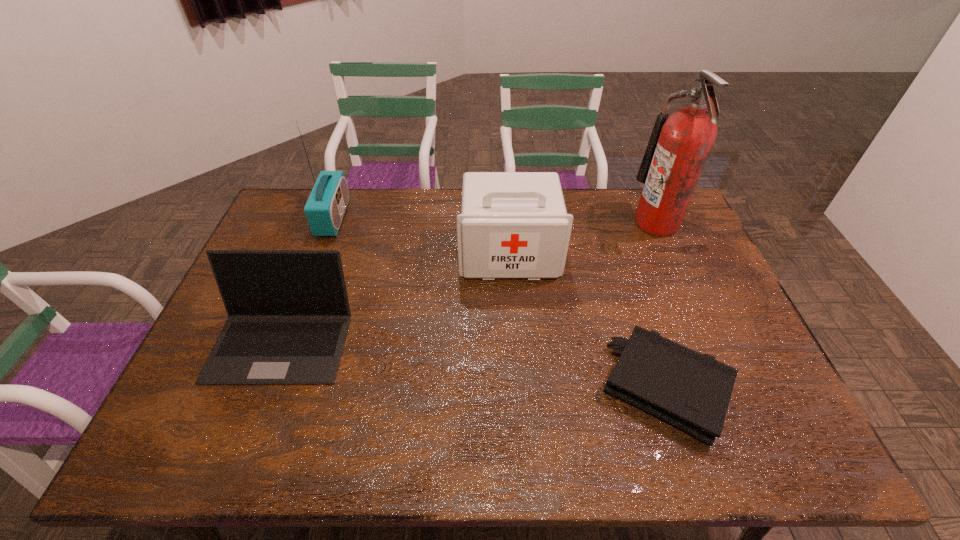
At what (x,y) coordinates should I click in order to perform the action: click on Bible positioned at the right edge. Please return your answer as a coordinate pair (x, y). This screenshot has width=960, height=540. Looking at the image, I should click on (691, 391).

Find the location of a particular element. This screenshot has width=960, height=540. object that is at the far left corner is located at coordinates (325, 208).

Locate an element on the screen. Image resolution: width=960 pixels, height=540 pixels. object that is at the far right corner is located at coordinates (678, 148).

What are the coordinates of `object that is at the near right corner` in the screenshot? It's located at (691, 391).

The height and width of the screenshot is (540, 960). I want to click on free space at the far edge of the desktop, so click(x=586, y=222).

Where is `vacant area at the near edge`? This screenshot has width=960, height=540. vacant area at the near edge is located at coordinates (632, 434).

In the image, there is a desktop. Identify the location of vacant space at the left edge. This screenshot has width=960, height=540. (210, 416).

You are a GUI agent. You are given a task and a screenshot of the screen. Output one action in this format:
    pyautogui.click(x=<x>, y=<y>)
    Task: Click on the vacant region at the right edge of the desktop
    This screenshot has height=540, width=960.
    Given the screenshot: What is the action you would take?
    pyautogui.click(x=721, y=315)

This screenshot has height=540, width=960. In order to click on vacant region between the fourth tallest object and the Bible in this screenshot , I will do [x=474, y=364].

This screenshot has width=960, height=540. Find the location of `free space between the third tallest object and the shortest object`. free space between the third tallest object and the shortest object is located at coordinates (588, 321).